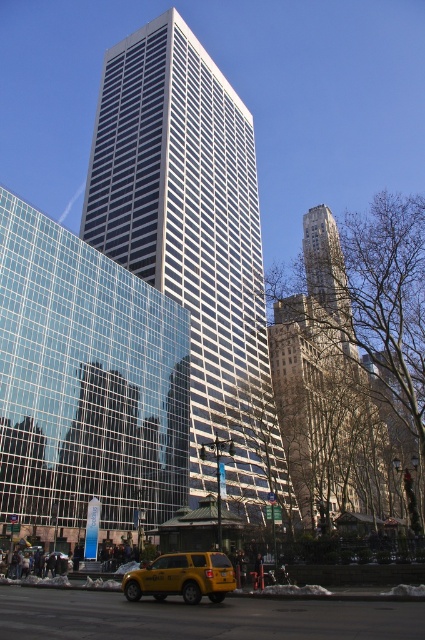
Does white glass building at center come behind brown stone tower at center?

Yes.

Is white glass building at center to the right of brown stone tower at center from the viewer's perspective?

Incorrect, white glass building at center is not on the right side of brown stone tower at center.

Between point (234, 349) and point (360, 401), which one is positioned behind?

The point (360, 401) is more distant.

Identify the location of white glass building at center. point(192,241).

Does brown stone tower at center have a greater height compared to yellow matte taxi at lower center?

Yes.

Can you confirm if brown stone tower at center is smaller than yellow matte taxi at lower center?

No.

Between point (289, 353) and point (172, 573), which one is positioned in front?

Point (172, 573) is more forward.

This screenshot has height=640, width=425. What are the coordinates of `brown stone tower at center` in the screenshot? It's located at [x=326, y=390].

Is white glass building at center smaller than clear glass building at center?

Actually, white glass building at center might be larger than clear glass building at center.

Between point (210, 216) and point (79, 305), which one is positioned in front?

Positioned in front is point (79, 305).

This screenshot has width=425, height=640. Identify the location of white glass building at center. (192, 241).